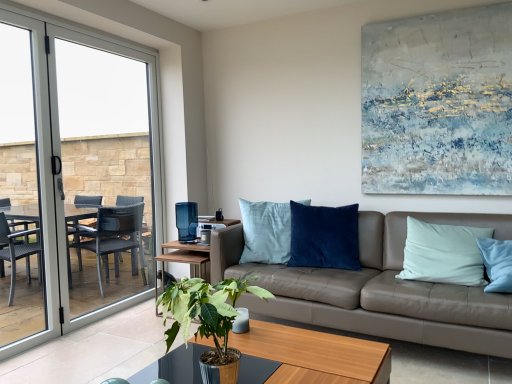
Find the location of a particular element. The image size is (512, 384). vacant space underneath textured canvas painting at upper right (from a real-world perspective) is located at coordinates (412, 205).